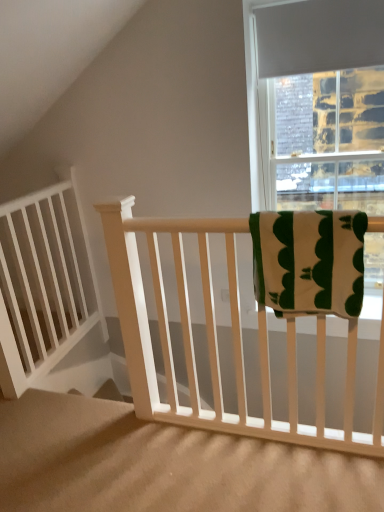
Question: Is white matte balustrade at left wider or thinner than green cotton towel at upper right?

Choices:
 (A) wide
 (B) thin

Answer: (B)

Question: Relative to green cotton towel at upper right, is white matte balustrade at left in front or behind?

Choices:
 (A) behind
 (B) front

Answer: (A)

Question: Which of these objects is positioned closest to the green cotton towel at upper right?

Choices:
 (A) white wood stairs at center
 (B) white matte balustrade at left

Answer: (A)

Question: Estimate the real-world distances between objects in this image. Which object is closer to the white wood stairs at center?

Choices:
 (A) white matte balustrade at left
 (B) green cotton towel at upper right

Answer: (A)